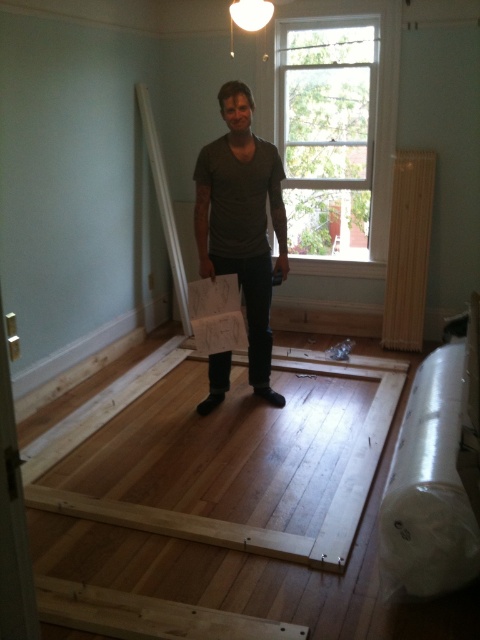
You are a GUI agent. You are given a task and a screenshot of the screen. Output one action in this format:
    pyautogui.click(x=<x>, y=<y>)
    Task: Click on the white wood window at upper center
    The width and height of the screenshot is (480, 640).
    Given the screenshot: What is the action you would take?
    pyautogui.click(x=333, y=132)

Who is more forward, (299, 228) or (244, 269)?

Point (244, 269) is in front.

Locate an element on the screen. white wood window at upper center is located at coordinates (333, 132).